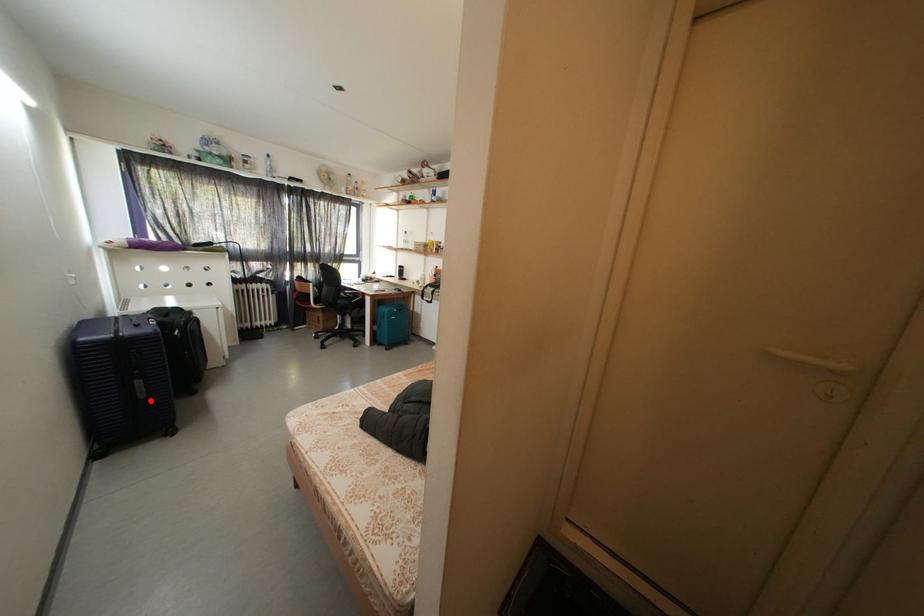
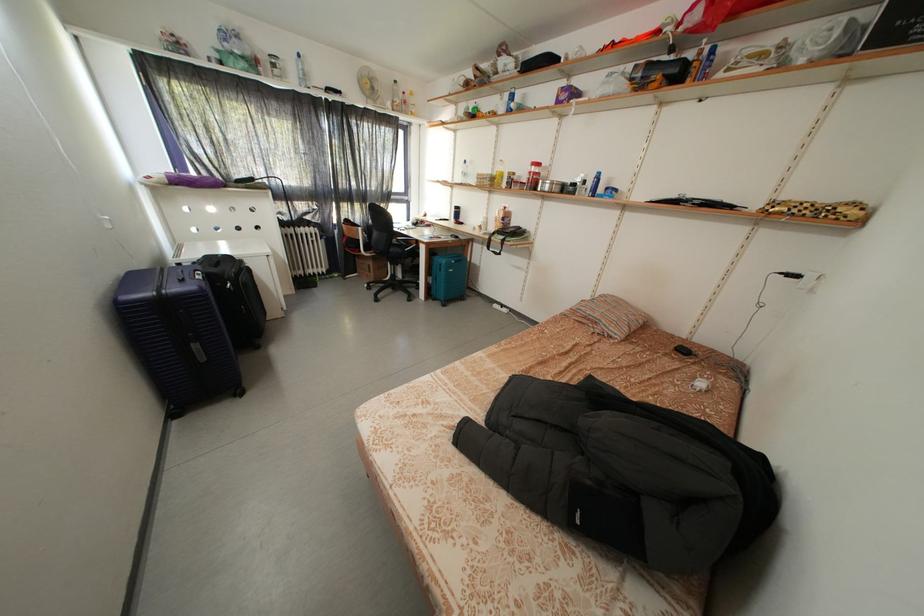
In the second image, find the point that corresponds to the highlighted location in the first image.

(211, 363)